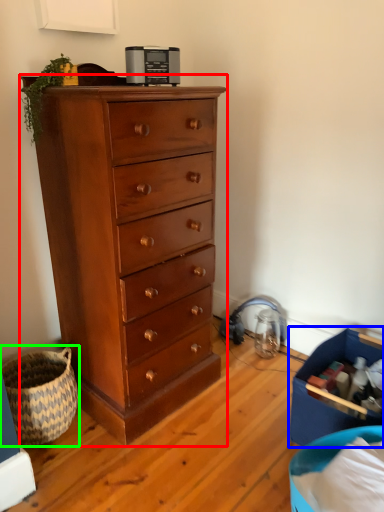
Question: Which is nearer to the chest of drawers (highlighted by a red box)? storage box (highlighted by a blue box) or basket (highlighted by a green box).

Choices:
 (A) storage box
 (B) basket

Answer: (B)